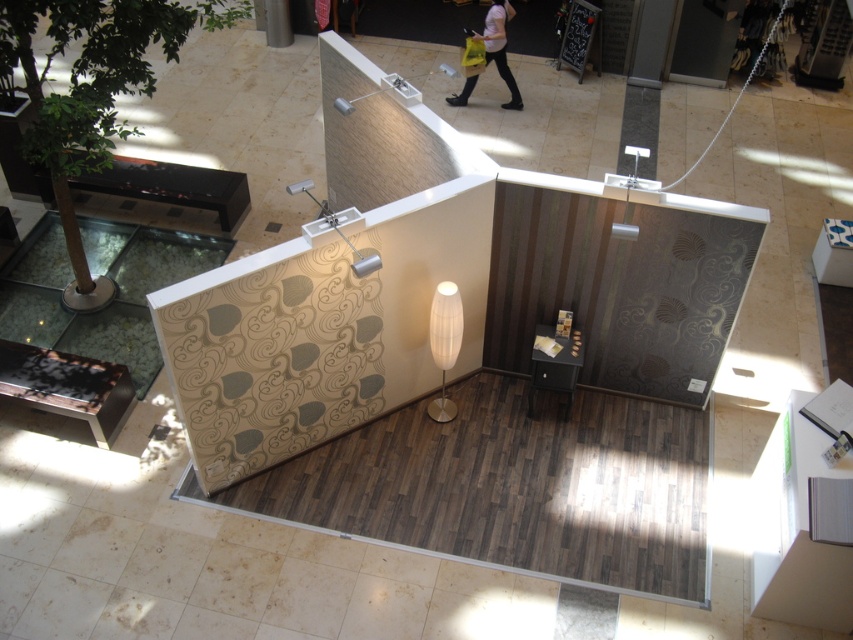
Does wooden laminate floor at center have a larger size compared to matte pink shirt at upper center?

Yes, wooden laminate floor at center is bigger than matte pink shirt at upper center.

Who is more distant from viewer, (x=520, y=500) or (x=503, y=51)?

The point (x=503, y=51) is more distant.

Locate an element on the screen. wooden laminate floor at center is located at coordinates (509, 486).